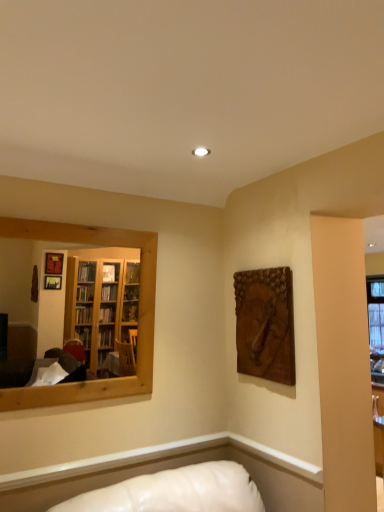
Question: Should I look upward or downward to see wooden carving at upper right?

Choices:
 (A) down
 (B) up

Answer: (A)

Question: Does wooden mirror at left lie in front of wooden carving at upper right?

Choices:
 (A) no
 (B) yes

Answer: (B)

Question: From a real-world perspective, is wooden mirror at left physically below wooden carving at upper right?

Choices:
 (A) yes
 (B) no

Answer: (B)

Question: Can you confirm if wooden mirror at left is wider than wooden carving at upper right?

Choices:
 (A) yes
 (B) no

Answer: (A)

Question: Is wooden mirror at left to the left of wooden carving at upper right from the viewer's perspective?

Choices:
 (A) yes
 (B) no

Answer: (A)

Question: From the image's perspective, would you say wooden mirror at left is positioned over wooden carving at upper right?

Choices:
 (A) no
 (B) yes

Answer: (B)

Question: Does wooden mirror at left have a larger size compared to wooden carving at upper right?

Choices:
 (A) yes
 (B) no

Answer: (A)

Question: Does wooden carving at upper right have a larger size compared to wooden mirror at left?

Choices:
 (A) no
 (B) yes

Answer: (A)

Question: Is wooden carving at upper right wider than wooden mirror at left?

Choices:
 (A) yes
 (B) no

Answer: (B)

Question: Does wooden carving at upper right appear on the left side of wooden mirror at left?

Choices:
 (A) no
 (B) yes

Answer: (A)

Question: Is wooden carving at upper right facing towards wooden mirror at left?

Choices:
 (A) yes
 (B) no

Answer: (A)

Question: From a real-world perspective, is wooden carving at upper right over wooden mirror at left?

Choices:
 (A) no
 (B) yes

Answer: (A)

Question: From the image's perspective, does wooden carving at upper right appear higher than wooden mirror at left?

Choices:
 (A) no
 (B) yes

Answer: (A)

Question: From the image's perspective, is wooden mirror at left located above or below wooden carving at upper right?

Choices:
 (A) above
 (B) below

Answer: (A)